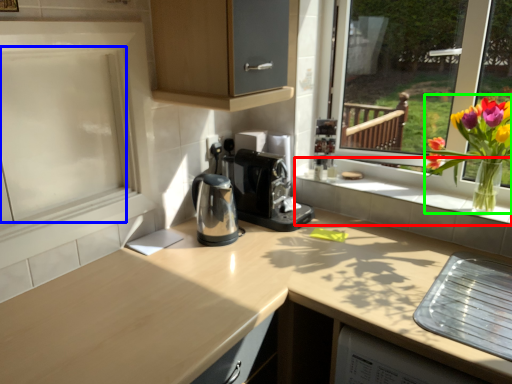
Question: Based on their relative distances, which object is nearer to window sill (highlighted by a red box)? Choose from screen door (highlighted by a blue box) and floral arrangement (highlighted by a green box).

Choices:
 (A) screen door
 (B) floral arrangement

Answer: (B)